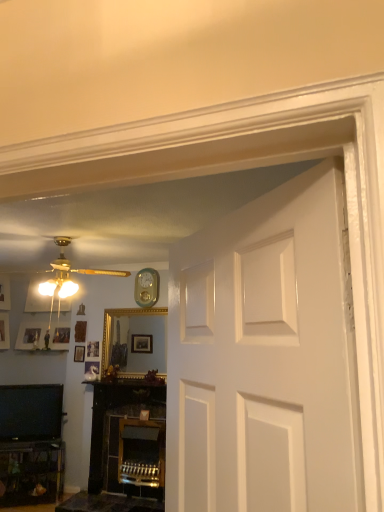
Question: Considering the relative positions of teal glossy clock at upper center and wooden picture frame at center in the image provided, is teal glossy clock at upper center to the right of wooden picture frame at center from the viewer's perspective?

Choices:
 (A) no
 (B) yes

Answer: (B)

Question: Is teal glossy clock at upper center looking in the opposite direction of wooden picture frame at center?

Choices:
 (A) no
 (B) yes

Answer: (A)

Question: Is teal glossy clock at upper center with wooden picture frame at center?

Choices:
 (A) yes
 (B) no

Answer: (B)

Question: Is teal glossy clock at upper center thinner than wooden picture frame at center?

Choices:
 (A) yes
 (B) no

Answer: (B)

Question: Considering the relative sizes of teal glossy clock at upper center and wooden picture frame at center in the image provided, is teal glossy clock at upper center smaller than wooden picture frame at center?

Choices:
 (A) yes
 (B) no

Answer: (B)

Question: Considering the relative positions of black glossy television at lower left and matte gold ceiling fan at upper left in the image provided, is black glossy television at lower left to the left or to the right of matte gold ceiling fan at upper left?

Choices:
 (A) left
 (B) right

Answer: (A)

Question: Considering their positions, is black glossy television at lower left located in front of or behind matte gold ceiling fan at upper left?

Choices:
 (A) behind
 (B) front

Answer: (A)

Question: In terms of width, does black glossy television at lower left look wider or thinner when compared to matte gold ceiling fan at upper left?

Choices:
 (A) wide
 (B) thin

Answer: (B)

Question: From the image's perspective, is black glossy television at lower left above or below matte gold ceiling fan at upper left?

Choices:
 (A) above
 (B) below

Answer: (B)

Question: Would you say matte gold ceiling fan at upper left is inside or outside wooden picture frame at center?

Choices:
 (A) inside
 (B) outside

Answer: (B)

Question: Considering the positions of matte gold ceiling fan at upper left and wooden picture frame at center in the image, is matte gold ceiling fan at upper left bigger or smaller than wooden picture frame at center?

Choices:
 (A) small
 (B) big

Answer: (B)

Question: Is matte gold ceiling fan at upper left in front of or behind wooden picture frame at center in the image?

Choices:
 (A) behind
 (B) front

Answer: (B)

Question: Would you say matte gold ceiling fan at upper left is to the left or to the right of wooden picture frame at center in the picture?

Choices:
 (A) right
 (B) left

Answer: (A)

Question: From the image's perspective, is gold metallic ceiling fan at upper left positioned above or below wooden picture frame at center?

Choices:
 (A) above
 (B) below

Answer: (A)

Question: Is gold metallic ceiling fan at upper left wider or thinner than wooden picture frame at center?

Choices:
 (A) thin
 (B) wide

Answer: (B)